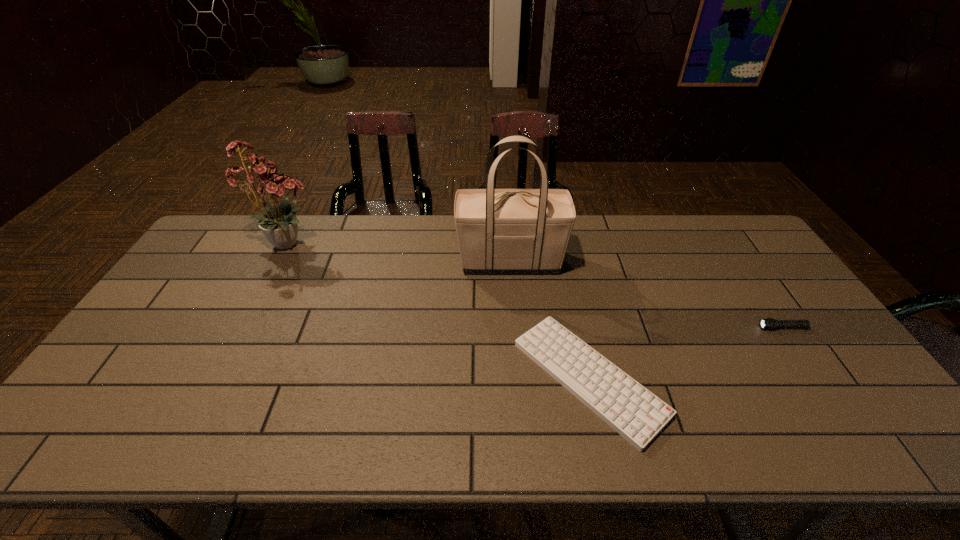
Locate an element on the screen. This screenshot has height=540, width=960. free space at the right edge of the desktop is located at coordinates (761, 258).

Where is `free point at the near left corner`? This screenshot has height=540, width=960. free point at the near left corner is located at coordinates click(x=122, y=449).

Locate an element on the screen. The height and width of the screenshot is (540, 960). vacant space at the far right corner is located at coordinates 701,224.

Image resolution: width=960 pixels, height=540 pixels. I want to click on free space at the near right corner of the desktop, so click(x=841, y=424).

In order to click on free area in between the flower arrangement and the computer keyboard in this screenshot , I will do `click(440, 310)`.

What are the coordinates of `vacant point located between the leftmost object and the shopping bag` in the screenshot? It's located at (400, 253).

The image size is (960, 540). Find the location of `free space between the leftmost object and the flashlight`. free space between the leftmost object and the flashlight is located at coordinates (536, 285).

I want to click on empty location between the shopping bag and the flashlight, so click(x=646, y=295).

Where is `free area in between the flower arrangement and the computer keyboard`? This screenshot has height=540, width=960. free area in between the flower arrangement and the computer keyboard is located at coordinates (440, 310).

I want to click on free space that is in between the computer keyboard and the flower arrangement, so click(x=440, y=310).